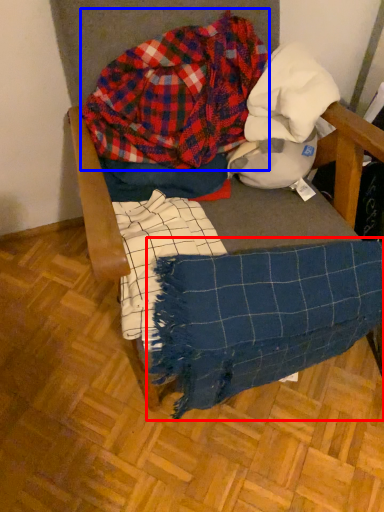
Question: Which object is closer to the camera taking this photo, blanket (highlighted by a red box) or flannel (highlighted by a blue box)?

Choices:
 (A) blanket
 (B) flannel

Answer: (A)